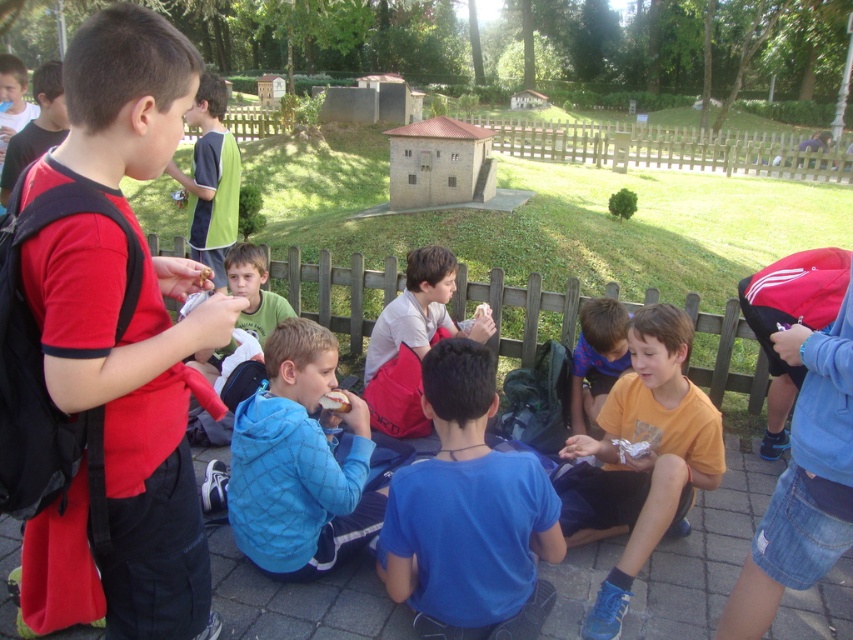
Question: Is orange cotton shirt at center below green fabric shirt at upper center?

Choices:
 (A) no
 (B) yes

Answer: (B)

Question: Which is farther from the orange cotton shirt at center?

Choices:
 (A) wooden picket fence at upper right
 (B) white matte chocolate bar at lower center
 (C) green fabric shirt at upper center

Answer: (A)

Question: Does red matte shirt at left have a greater width compared to matte red backpack at left?

Choices:
 (A) no
 (B) yes

Answer: (A)

Question: Among these objects, which one is nearest to the camera?

Choices:
 (A) red matte shirt at left
 (B) white matte chocolate bar at lower center
 (C) blue fabric shirt at center

Answer: (A)

Question: Considering the relative positions of red matte shirt at left and green fabric shirt at upper center in the image provided, where is red matte shirt at left located with respect to green fabric shirt at upper center?

Choices:
 (A) right
 (B) left

Answer: (A)

Question: Which of these objects is positioned closest to the orange cotton shirt at center?

Choices:
 (A) wooden picket fence at upper right
 (B) white matte chocolate bar at lower center
 (C) red matte shirt at left
 (D) blue quilted jacket at center

Answer: (D)